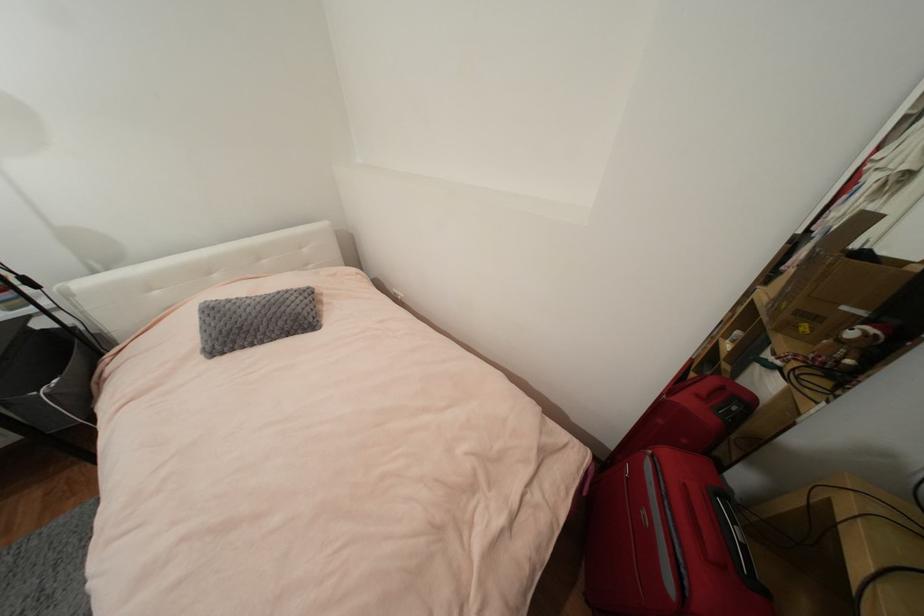
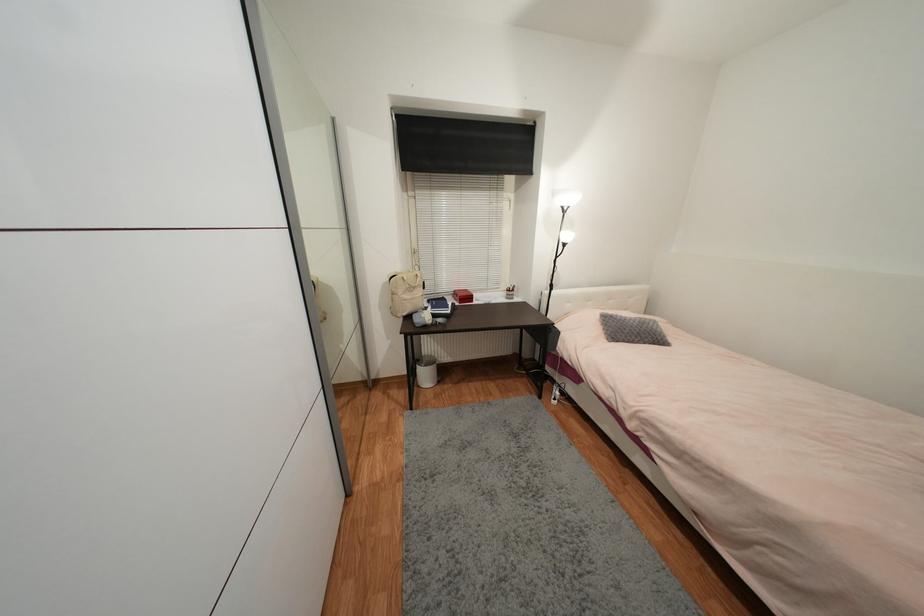
In the second image, find the point that corresponds to the point at 258,314 in the first image.

(639, 326)